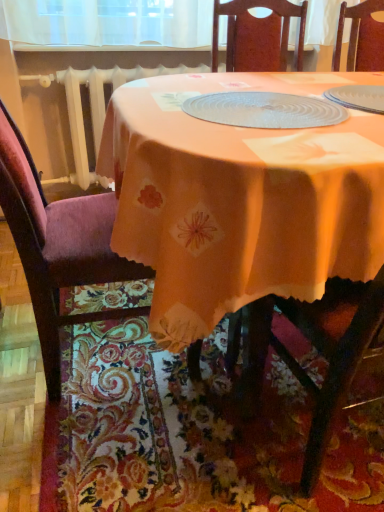
Find the location of a particular element. This screenshot has width=384, height=512. free space to the left of clear plastic placemat at center is located at coordinates (x=152, y=103).